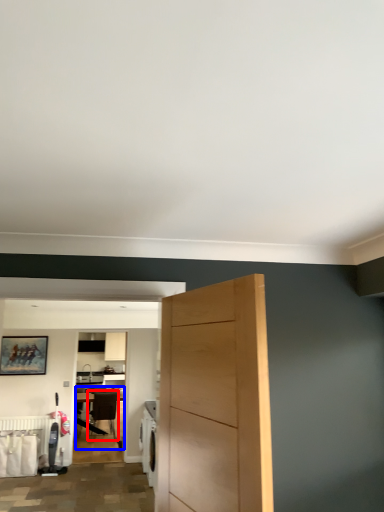
Question: Which object appears closest to the camera in this image, chair (highlighted by a red box) or table (highlighted by a blue box)?

Choices:
 (A) chair
 (B) table

Answer: (A)